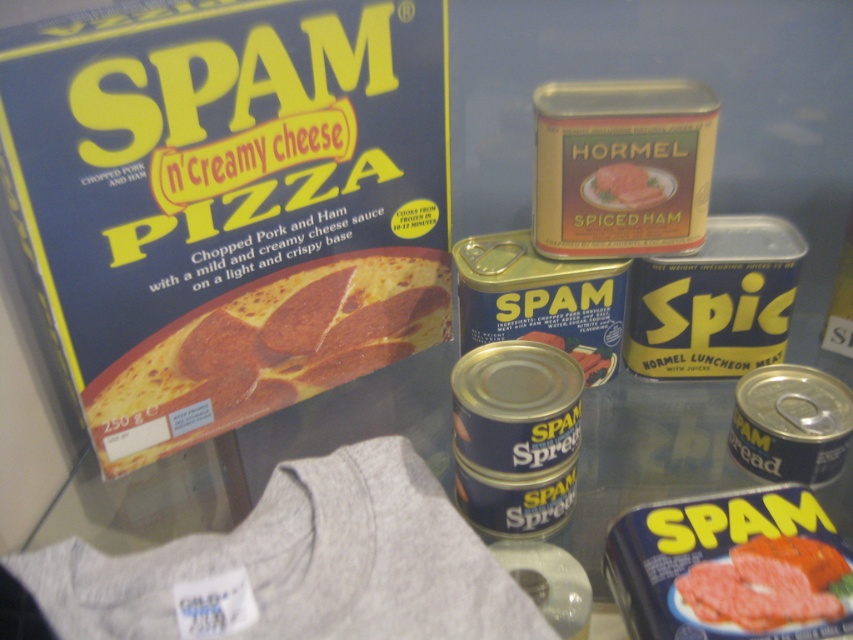
Question: Which object is closer to the camera taking this photo?

Choices:
 (A) yellow matte pizza at upper left
 (B) spiced ham at center

Answer: (A)

Question: Among these points, which one is nearest to the camera?

Choices:
 (A) (181, 384)
 (B) (712, 564)
 (C) (593, 186)

Answer: (B)

Question: Where is yellow matte pizza at upper left located in relation to spiced ham at center in the image?

Choices:
 (A) above
 (B) below

Answer: (B)

Question: Does smooth pink ham at center appear on the right side of spiced ham at center?

Choices:
 (A) yes
 (B) no

Answer: (A)

Question: Among these points, which one is farthest from the camera?

Choices:
 (A) (682, 588)
 (B) (585, 186)
 (C) (131, 440)

Answer: (B)

Question: Observing the image, what is the correct spatial positioning of yellow matte pizza at upper left in reference to smooth pink ham at center?

Choices:
 (A) below
 (B) above

Answer: (B)